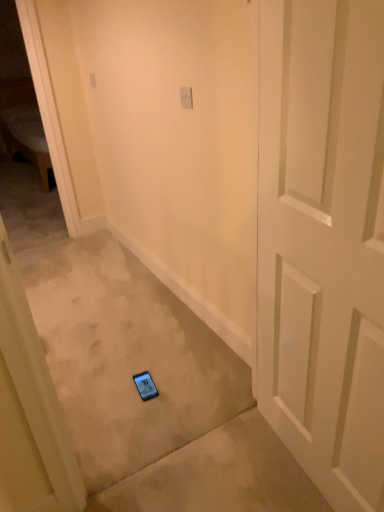
The height and width of the screenshot is (512, 384). Find the location of `white plastic light switch at upper center, the 2th light switch viewed from the front`. white plastic light switch at upper center, the 2th light switch viewed from the front is located at coordinates (92, 80).

Locate an element on the screen. Image resolution: width=384 pixels, height=512 pixels. white matte door at center is located at coordinates (323, 241).

In order to click on white plastic light switch at upper center, positioned as the 1th light switch in front-to-back order in this screenshot , I will do `click(186, 97)`.

Considering the sizes of objects white plastic light switch at upper center, the second light switch when ordered from right to left, and white plastic light switch at upper center, which ranks as the 2th light switch in top-to-bottom order, in the image provided, who is taller, white plastic light switch at upper center, the second light switch when ordered from right to left, or white plastic light switch at upper center, which ranks as the 2th light switch in top-to-bottom order,?

Standing taller between the two is white plastic light switch at upper center, the second light switch when ordered from right to left.

In the scene shown: Considering the relative positions of white plastic light switch at upper center, which ranks as the 1th light switch in left-to-right order, and white plastic light switch at upper center, which is counted as the first light switch, starting from the bottom, in the image provided, is white plastic light switch at upper center, which ranks as the 1th light switch in left-to-right order, in front of white plastic light switch at upper center, which is counted as the first light switch, starting from the bottom,?

No, it is behind white plastic light switch at upper center, which is counted as the first light switch, starting from the bottom.

From a real-world perspective, who is located higher, white plastic light switch at upper center, which ranks as the 1th light switch in left-to-right order, or white plastic light switch at upper center, which is counted as the first light switch, starting from the bottom?

In real-world perspective, white plastic light switch at upper center, which is counted as the first light switch, starting from the bottom, is above.

Is white plastic light switch at upper center, which appears as the 1th light switch when viewed from the top, positioned beyond the bounds of white plastic light switch at upper center, which is counted as the first light switch, starting from the bottom?

white plastic light switch at upper center, which appears as the 1th light switch when viewed from the top, lies outside white plastic light switch at upper center, which is counted as the first light switch, starting from the bottom,'s area.

Which object is closer to the camera taking this photo, white matte door at center or white plastic light switch at upper center, the 2th light switch viewed from the front?

white matte door at center is in front.

Is point (324, 248) less distant than point (92, 82)?

Yes.

How different are the orientations of white matte door at center and white plastic light switch at upper center, which ranks as the 1th light switch in left-to-right order, in degrees?

5.21 degrees.

Is white matte door at center bigger than white plastic light switch at upper center, acting as the first light switch starting from the back?

Correct, white matte door at center is larger in size than white plastic light switch at upper center, acting as the first light switch starting from the back.

The height and width of the screenshot is (512, 384). In order to click on light switch that is the 2nd object above the white matte door at center (from a real-world perspective) in this screenshot , I will do `click(186, 97)`.

Is white plastic light switch at upper center, positioned as the 1th light switch in front-to-back order, not within white matte door at center?

Yes, white plastic light switch at upper center, positioned as the 1th light switch in front-to-back order, is located beyond the bounds of white matte door at center.

Can you tell me how much white plastic light switch at upper center, which is the 2th light switch from back to front, and white matte door at center differ in facing direction?

8.43 degrees separate the facing orientations of white plastic light switch at upper center, which is the 2th light switch from back to front, and white matte door at center.

Does white plastic light switch at upper center, positioned as the 1th light switch in right-to-left order, have a lesser width compared to white matte door at center?

Correct, the width of white plastic light switch at upper center, positioned as the 1th light switch in right-to-left order, is less than that of white matte door at center.

From the image's perspective, which one is positioned lower, white plastic light switch at upper center, acting as the first light switch starting from the back, or white matte door at center?

From the image's view, white matte door at center is below.

Can you confirm if white plastic light switch at upper center, acting as the first light switch starting from the back, is positioned to the left of white matte door at center?

Yes, white plastic light switch at upper center, acting as the first light switch starting from the back, is to the left of white matte door at center.

Is white plastic light switch at upper center, acting as the first light switch starting from the back, turned away from white matte door at center?

white plastic light switch at upper center, acting as the first light switch starting from the back, does not have its back to white matte door at center.

The height and width of the screenshot is (512, 384). There is a white matte door at center. In order to click on the 2nd light switch above it (from the image's perspective) in this screenshot , I will do `click(92, 80)`.

Would you say white plastic light switch at upper center, which is counted as the first light switch, starting from the bottom, is part of white matte door at center's contents?

No, white plastic light switch at upper center, which is counted as the first light switch, starting from the bottom, is not surrounded by white matte door at center.

From the image's perspective, which is above, white matte door at center or white plastic light switch at upper center, which ranks as the 2th light switch in top-to-bottom order?

white plastic light switch at upper center, which ranks as the 2th light switch in top-to-bottom order.

Which object is wider, white matte door at center or white plastic light switch at upper center, which is counted as the first light switch, starting from the bottom?

white matte door at center is wider.

Between white plastic light switch at upper center, which is the second light switch in left-to-right order, and white plastic light switch at upper center, which appears as the 1th light switch when viewed from the top, which one is positioned behind?

white plastic light switch at upper center, which appears as the 1th light switch when viewed from the top, is further from the camera.

Would you say white plastic light switch at upper center, which is the second light switch in left-to-right order, is a long distance from white plastic light switch at upper center, the second light switch when ordered from right to left?

That's right, there is a large distance between white plastic light switch at upper center, which is the second light switch in left-to-right order, and white plastic light switch at upper center, the second light switch when ordered from right to left.

From the image's perspective, is white plastic light switch at upper center, which ranks as the 2th light switch in top-to-bottom order, above or below white plastic light switch at upper center, the second light switch when ordered from right to left?

From the image's perspective, white plastic light switch at upper center, which ranks as the 2th light switch in top-to-bottom order, appears below white plastic light switch at upper center, the second light switch when ordered from right to left.

In the image, there is a white plastic light switch at upper center, acting as the first light switch starting from the back. What are the coordinates of `light switch below it (from the image's perspective)` in the screenshot? It's located at (186, 97).

Where is `light switch that appears above the white plastic light switch at upper center, which ranks as the 1th light switch in left-to-right order (from a real-world perspective)`? The image size is (384, 512). light switch that appears above the white plastic light switch at upper center, which ranks as the 1th light switch in left-to-right order (from a real-world perspective) is located at coordinates (186, 97).

Locate an element on the screen. The image size is (384, 512). door located below the white plastic light switch at upper center, which ranks as the 1th light switch in left-to-right order (from the image's perspective) is located at coordinates (323, 241).

Looking at this image, from the image, which object appears to be nearer to white plastic light switch at upper center, the 2th light switch viewed from the front, white matte door at center or white plastic light switch at upper center, positioned as the 1th light switch in front-to-back order?

white plastic light switch at upper center, positioned as the 1th light switch in front-to-back order, is closer to white plastic light switch at upper center, the 2th light switch viewed from the front.

Considering their positions, is white plastic light switch at upper center, positioned as the 1th light switch in right-to-left order, positioned further to white plastic light switch at upper center, the 2th light switch viewed from the front, than white matte door at center?

white matte door at center is further to white plastic light switch at upper center, the 2th light switch viewed from the front.

Looking at the image, which one is located closer to white plastic light switch at upper center, which is the 2th light switch from back to front, white plastic light switch at upper center, which is the second light switch in bottom-to-top order, or white matte door at center?

white matte door at center lies closer to white plastic light switch at upper center, which is the 2th light switch from back to front, than the other object.

Looking at the image, which one is located further to white matte door at center, white plastic light switch at upper center, the 2th light switch viewed from the front, or white plastic light switch at upper center, positioned as the 1th light switch in front-to-back order?

white plastic light switch at upper center, the 2th light switch viewed from the front, is positioned further to the anchor white matte door at center.

Based on their spatial positions, is white matte door at center or white plastic light switch at upper center, acting as the first light switch starting from the back, closer to white plastic light switch at upper center, which is the 2th light switch from back to front?

white matte door at center.

When comparing their distances from white matte door at center, does white plastic light switch at upper center, which is the second light switch in left-to-right order, or white plastic light switch at upper center, which appears as the 1th light switch when viewed from the top, seem further?

Based on the image, white plastic light switch at upper center, which appears as the 1th light switch when viewed from the top, appears to be further to white matte door at center.

Identify the location of light switch positioned between white matte door at center and white plastic light switch at upper center, the second light switch when ordered from right to left, from near to far. (186, 97).